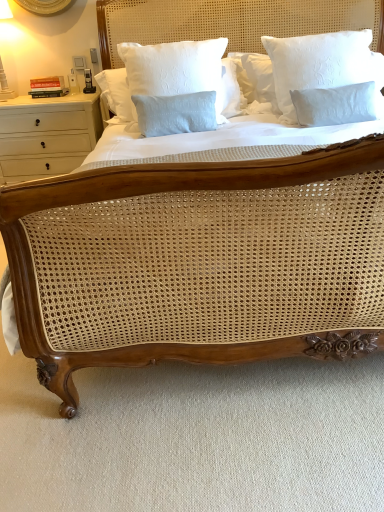
Question: From a real-world perspective, is white textured pillow at upper right, which ranks as the 1th pillow in right-to-left order, positioned under light blue cotton pillow at center, the 1th pillow positioned from the left, based on gravity?

Choices:
 (A) no
 (B) yes

Answer: (A)

Question: From a real-world perspective, is white textured pillow at upper right, which is counted as the 2th pillow, starting from the left, over light blue cotton pillow at center, the 1th pillow positioned from the left?

Choices:
 (A) yes
 (B) no

Answer: (A)

Question: From the image's perspective, does white textured pillow at upper right, which is counted as the 2th pillow, starting from the left, appear higher than light blue cotton pillow at center, which appears as the second pillow when viewed from the right?

Choices:
 (A) yes
 (B) no

Answer: (A)

Question: Is white textured pillow at upper right, which ranks as the 1th pillow in right-to-left order, to the left of light blue cotton pillow at center, which appears as the second pillow when viewed from the right, from the viewer's perspective?

Choices:
 (A) yes
 (B) no

Answer: (B)

Question: Is white textured pillow at upper right, which ranks as the 1th pillow in right-to-left order, shorter than light blue cotton pillow at center, which appears as the second pillow when viewed from the right?

Choices:
 (A) yes
 (B) no

Answer: (B)

Question: Is point (52, 110) positioned closer to the camera than point (196, 54)?

Choices:
 (A) farther
 (B) closer

Answer: (A)

Question: From a real-world perspective, is white wood drawer at left physically located above or below light blue cotton pillow at center, which appears as the second pillow when viewed from the right?

Choices:
 (A) above
 (B) below

Answer: (B)

Question: Is white wood drawer at left to the left or to the right of light blue cotton pillow at center, the 1th pillow positioned from the left, in the image?

Choices:
 (A) right
 (B) left

Answer: (B)

Question: Is white wood drawer at left in front of or behind light blue cotton pillow at center, which appears as the second pillow when viewed from the right, in the image?

Choices:
 (A) front
 (B) behind

Answer: (B)

Question: From the image's perspective, is white textured pillow at upper right, which ranks as the 1th pillow in right-to-left order, above or below white wood drawer at left?

Choices:
 (A) above
 (B) below

Answer: (A)

Question: From their relative heights in the image, would you say white textured pillow at upper right, which ranks as the 1th pillow in right-to-left order, is taller or shorter than white wood drawer at left?

Choices:
 (A) short
 (B) tall

Answer: (A)

Question: From a real-world perspective, is white textured pillow at upper right, which ranks as the 1th pillow in right-to-left order, positioned above or below white wood drawer at left?

Choices:
 (A) below
 (B) above

Answer: (B)

Question: Is white textured pillow at upper right, which is counted as the 2th pillow, starting from the left, in front of or behind white wood drawer at left in the image?

Choices:
 (A) behind
 (B) front

Answer: (B)

Question: Is light blue cotton pillow at center, the 1th pillow positioned from the left, spatially inside white wood drawer at left, or outside of it?

Choices:
 (A) inside
 (B) outside

Answer: (B)

Question: From a real-world perspective, relative to white wood drawer at left, is light blue cotton pillow at center, which appears as the second pillow when viewed from the right, vertically above or below?

Choices:
 (A) above
 (B) below

Answer: (A)